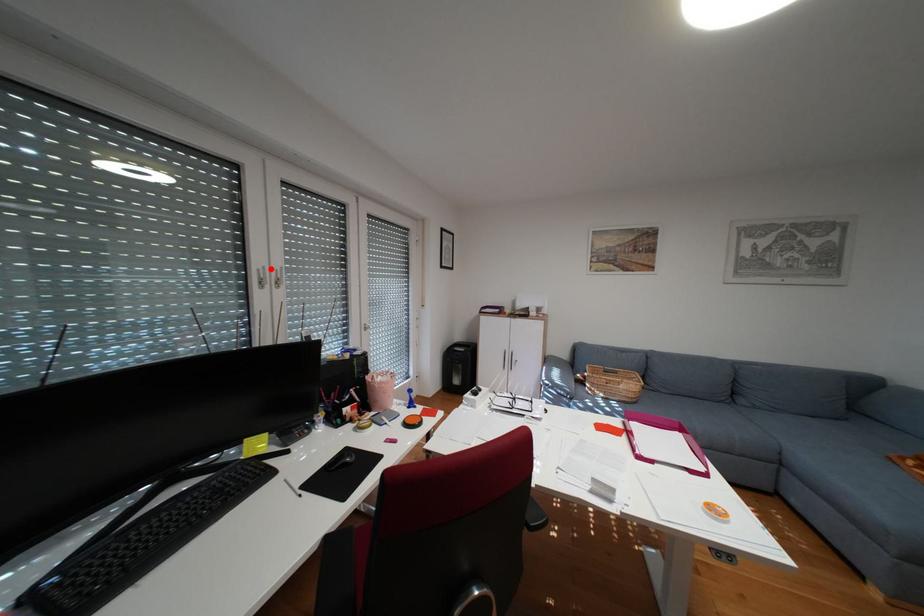
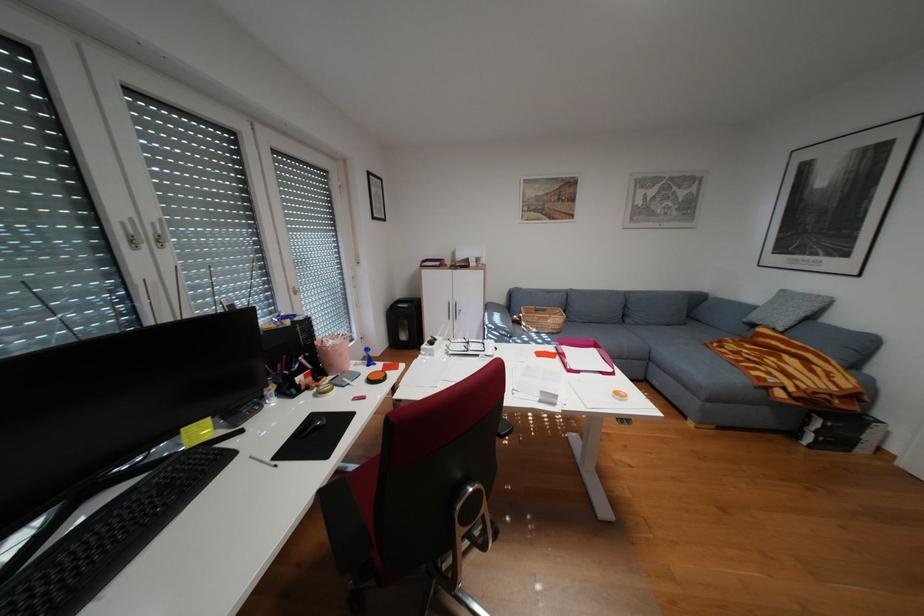
Where in the second image is the point corresponding to the highlighted location from the first image?

(135, 223)